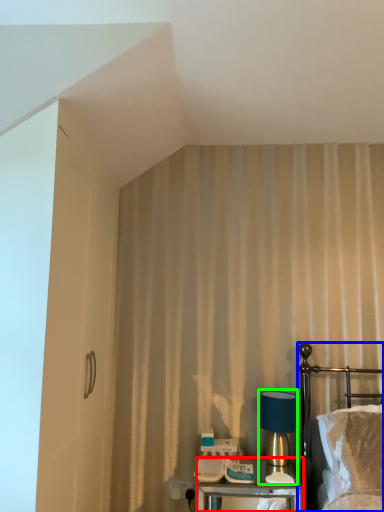
Question: Based on their relative distances, which object is nearer to nightstand (highlighted by a red box)? Choose from bed (highlighted by a blue box) and table lamp (highlighted by a green box).

Choices:
 (A) bed
 (B) table lamp

Answer: (B)